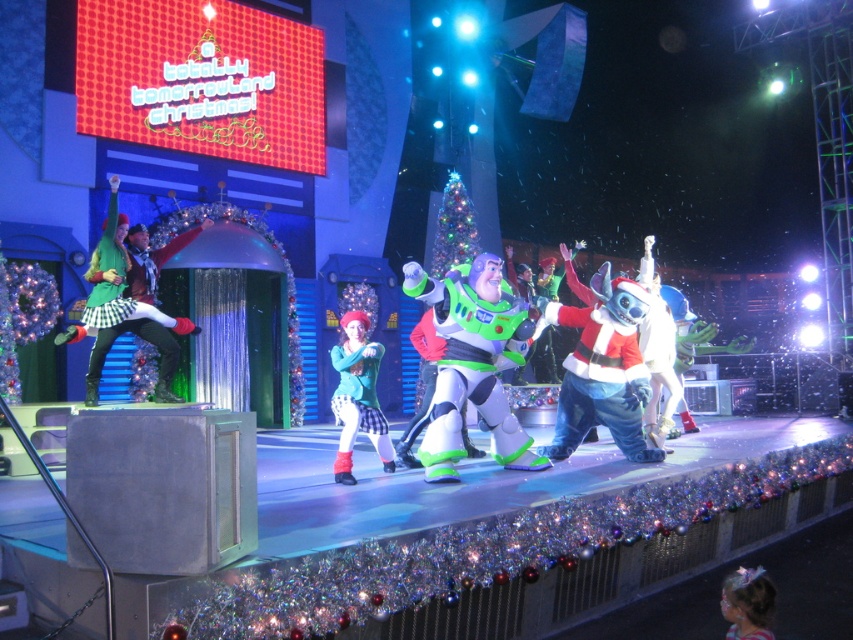
You are a stagehand at Disney Hollywood Studios. You need to place a new decoration at the exact center of the stage. However, you must avoid placing it near the green felt elf at left, which is located at point (128, 300). What are the coordinates of the center of the stage?

The center of the stage would be at point 0.5, 0.5. Since the green felt elf at left is at (128, 300), placing the decoration at 0.5, 0.5 keeps it centered and away from the elf.

You are a photographer at the event and want to capture a photo that includes both the white plush santa at center and the pastel pink hairband at lower right. Considering their sizes, which object should you focus on to ensure both are clearly visible in the frame?

The white plush santa at center is larger in size than the pastel pink hairband at lower right, so focusing on the white plush santa at center would ensure both are clearly visible in the frame.